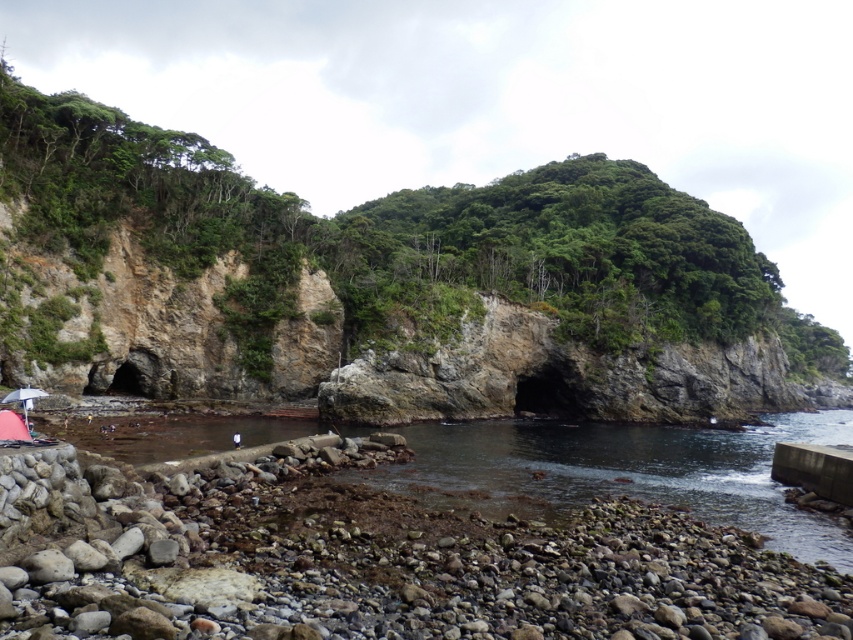
You are standing on the pebble beach and want to place your transparent plastic umbrella at lower left in a safe spot away from the rocky cliff at center. Based on the scene, where should you position it to avoid the cliff?

The rocky cliff at center is above the transparent plastic umbrella at lower left, so to keep it safe from the cliff, you should place the transparent plastic umbrella at lower left further away from the base of the rocky cliff at center.

You are planning to set up a small floating dock for kayaks in the coastal area shown. The dock needs to be placed where there is enough space. Based on the image, can you confirm if the clear water at lower center has enough space to accommodate the dock compared to the transparent plastic umbrella at lower left?

The clear water at lower center has a larger size compared to the transparent plastic umbrella at lower left, so it has enough space to accommodate the dock.